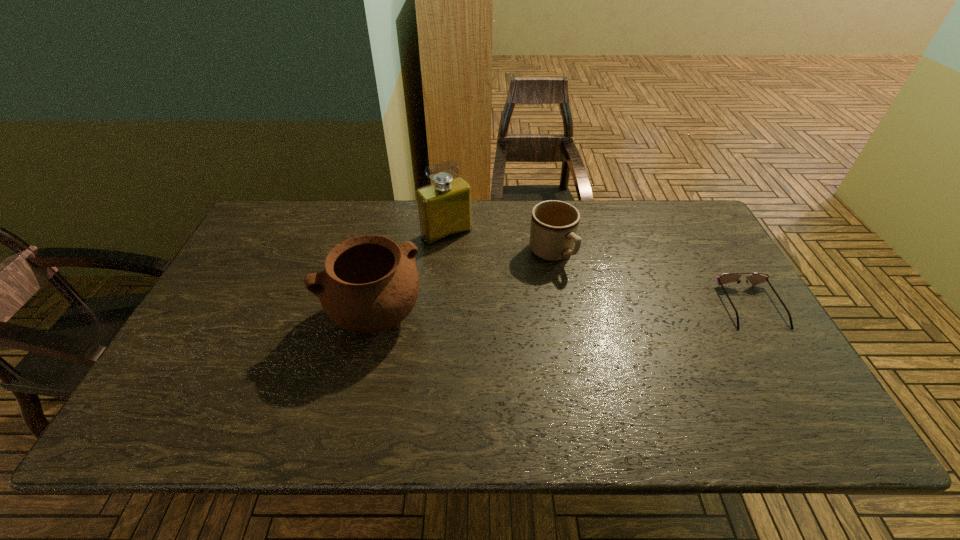
Identify the location of free space between the mug and the sunglasses. Image resolution: width=960 pixels, height=540 pixels. (651, 279).

Locate an element on the screen. This screenshot has width=960, height=540. vacant region between the second tallest object and the third tallest object is located at coordinates pyautogui.click(x=463, y=285).

Identify the location of unoccupied area between the third object from left to right and the perfume. (499, 243).

Identify which object is located as the nearest to the pottery. Please provide its 2D coordinates. Your answer should be formatted as a tuple, i.e. [(x, y)], where the tuple contains the x and y coordinates of a point satisfying the conditions above.

[(444, 208)]

The image size is (960, 540). I want to click on the second closest object to the second tallest object, so click(x=554, y=224).